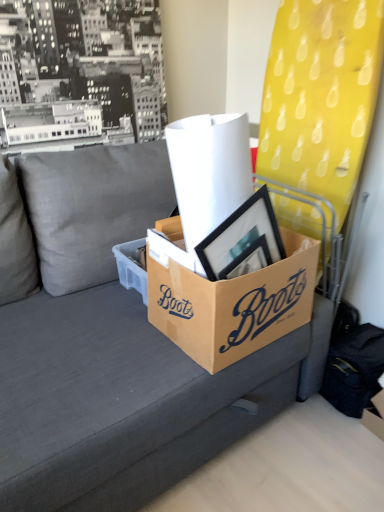
Question: Is gray fabric couch at center with brown cardboard box at center, the 2th box when ordered from left to right?

Choices:
 (A) no
 (B) yes

Answer: (A)

Question: Are gray fabric couch at center and brown cardboard box at center, the 2th box when ordered from left to right, located far from each other?

Choices:
 (A) yes
 (B) no

Answer: (B)

Question: Is gray fabric couch at center to the right of brown cardboard box at center, the 2th box when ordered from left to right, from the viewer's perspective?

Choices:
 (A) no
 (B) yes

Answer: (A)

Question: Can you confirm if gray fabric couch at center is bigger than brown cardboard box at center, the 2th box when ordered from left to right?

Choices:
 (A) no
 (B) yes

Answer: (B)

Question: Is gray fabric couch at center looking in the opposite direction of brown cardboard box at center, the 2th box when ordered from left to right?

Choices:
 (A) yes
 (B) no

Answer: (A)

Question: Is brown cardboard box at center, the first box from the left, in front of or behind cardboard box at lower right in the image?

Choices:
 (A) front
 (B) behind

Answer: (B)

Question: Looking at the image, does brown cardboard box at center, the first box from the left, seem bigger or smaller compared to cardboard box at lower right?

Choices:
 (A) big
 (B) small

Answer: (A)

Question: Considering the positions of brown cardboard box at center, the first box from the left, and cardboard box at lower right in the image, is brown cardboard box at center, the first box from the left, taller or shorter than cardboard box at lower right?

Choices:
 (A) tall
 (B) short

Answer: (A)

Question: Considering the positions of point (173, 230) and point (374, 413), is point (173, 230) closer or farther from the camera than point (374, 413)?

Choices:
 (A) closer
 (B) farther

Answer: (A)

Question: From the image's perspective, is cardboard box at lower right positioned above or below black cardboard box at center?

Choices:
 (A) below
 (B) above

Answer: (A)

Question: In terms of height, does cardboard box at lower right look taller or shorter compared to black cardboard box at center?

Choices:
 (A) short
 (B) tall

Answer: (A)

Question: In terms of width, does cardboard box at lower right look wider or thinner when compared to black cardboard box at center?

Choices:
 (A) thin
 (B) wide

Answer: (B)

Question: Considering their positions, is cardboard box at lower right located in front of or behind black cardboard box at center?

Choices:
 (A) front
 (B) behind

Answer: (B)

Question: Considering the positions of point (114, 245) and point (94, 468), is point (114, 245) closer or farther from the camera than point (94, 468)?

Choices:
 (A) closer
 (B) farther

Answer: (B)

Question: Is brown cardboard box at center, the second box when ordered from right to left, wider or thinner than gray fabric couch at center?

Choices:
 (A) wide
 (B) thin

Answer: (B)